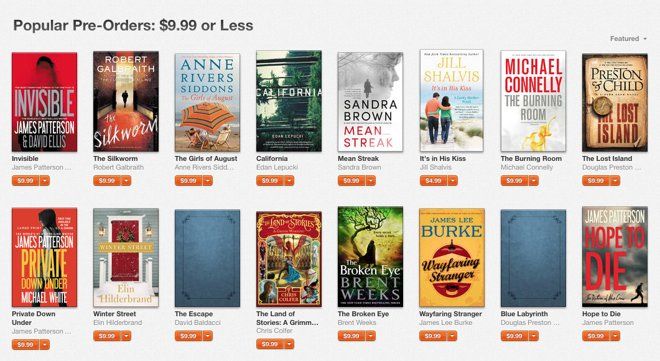
You are a GUI agent. You are given a task and a screenshot of the screen. Output one action in this format:
    pyautogui.click(x=<x>, y=<y>)
    Task: Click on the books in the top row
    The height and width of the screenshot is (361, 660).
    Given the screenshot: What is the action you would take?
    pyautogui.click(x=46, y=113), pyautogui.click(x=123, y=115), pyautogui.click(x=199, y=111), pyautogui.click(x=297, y=103), pyautogui.click(x=368, y=106), pyautogui.click(x=457, y=105), pyautogui.click(x=554, y=103), pyautogui.click(x=634, y=107)